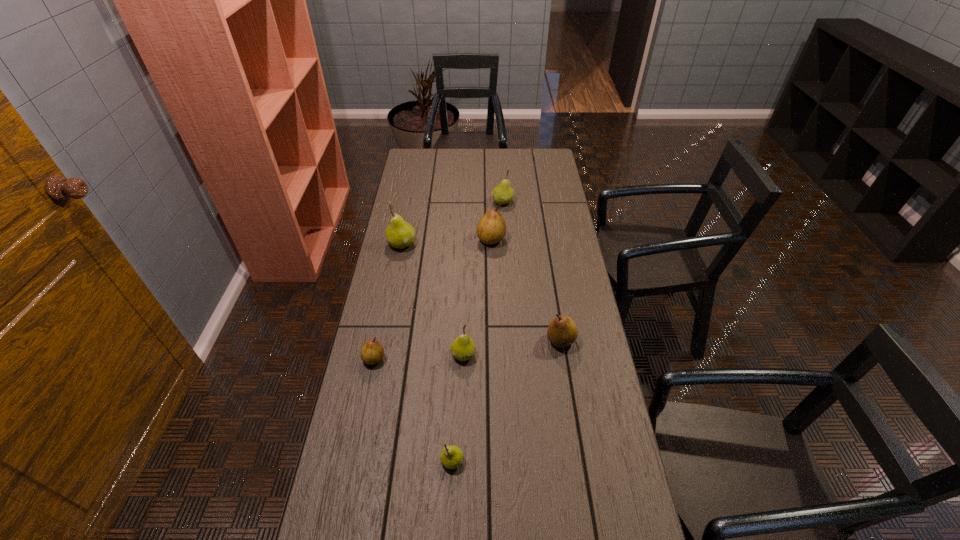
Find the location of a particular element. The height and width of the screenshot is (540, 960). free space that is in between the second smallest green pear and the farthest brown pear is located at coordinates (477, 297).

Find the location of a particular element. Image resolution: width=960 pixels, height=540 pixels. the sixth closest object to the smallest brown pear is located at coordinates (503, 193).

Point out which object is positioned as the fifth nearest to the rightmost green pear. Please provide its 2D coordinates. Your answer should be formatted as a tuple, i.e. [(x, y)], where the tuple contains the x and y coordinates of a point satisfying the conditions above.

[(372, 352)]

Locate an element on the screen. The height and width of the screenshot is (540, 960). the sixth closest pear relative to the leftmost brown pear is located at coordinates (503, 193).

Select which pear appears as the third closest to the nearest green pear. Please provide its 2D coordinates. Your answer should be formatted as a tuple, i.e. [(x, y)], where the tuple contains the x and y coordinates of a point satisfying the conditions above.

[(562, 331)]

Point out which green pear is positioned as the third nearest to the farthest brown pear. Please provide its 2D coordinates. Your answer should be formatted as a tuple, i.e. [(x, y)], where the tuple contains the x and y coordinates of a point satisfying the conditions above.

[(463, 348)]

Where is `the second closest green pear to the second nearest green pear`? the second closest green pear to the second nearest green pear is located at coordinates (399, 234).

This screenshot has width=960, height=540. I want to click on the closest brown pear to the smallest brown pear, so click(562, 331).

Identify which brown pear is the second closest to the nearest pear. Please provide its 2D coordinates. Your answer should be formatted as a tuple, i.e. [(x, y)], where the tuple contains the x and y coordinates of a point satisfying the conditions above.

[(562, 331)]

The height and width of the screenshot is (540, 960). Find the location of `free space that satisfies the following two spatial constraints: 1. on the back side of the farthest brown pear; 2. on the right side of the smallest brown pear`. free space that satisfies the following two spatial constraints: 1. on the back side of the farthest brown pear; 2. on the right side of the smallest brown pear is located at coordinates (398, 239).